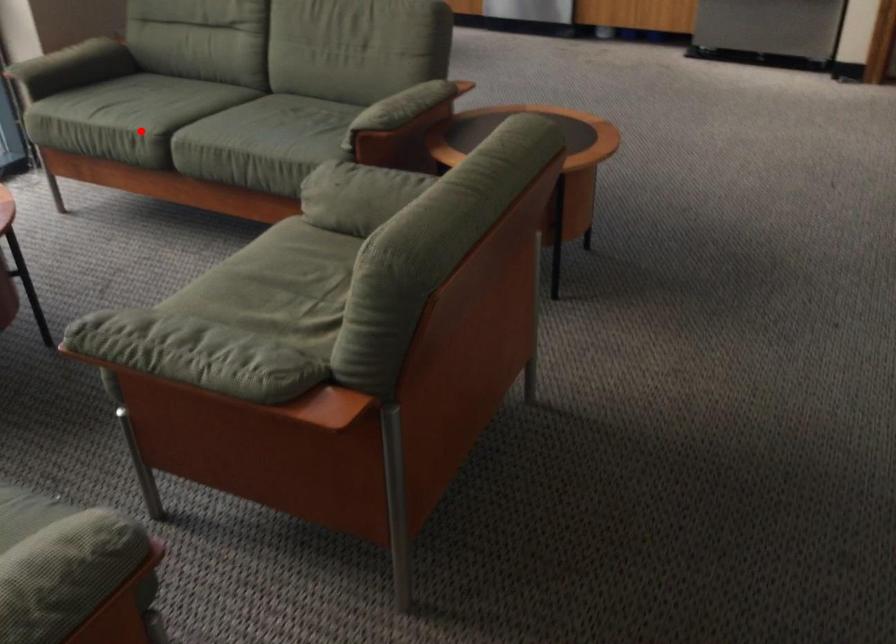
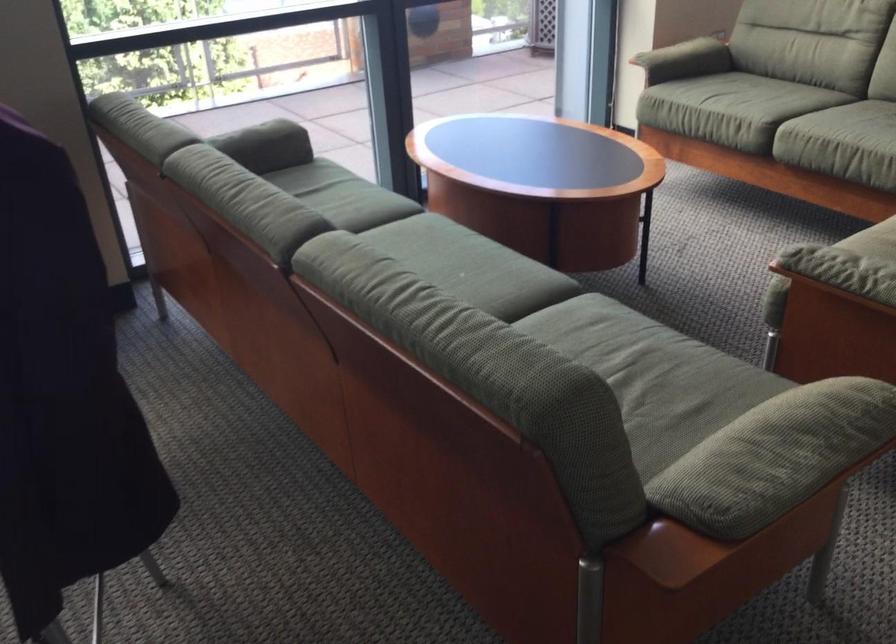
In the second image, find the point that corresponds to the highlighted location in the first image.

(751, 111)